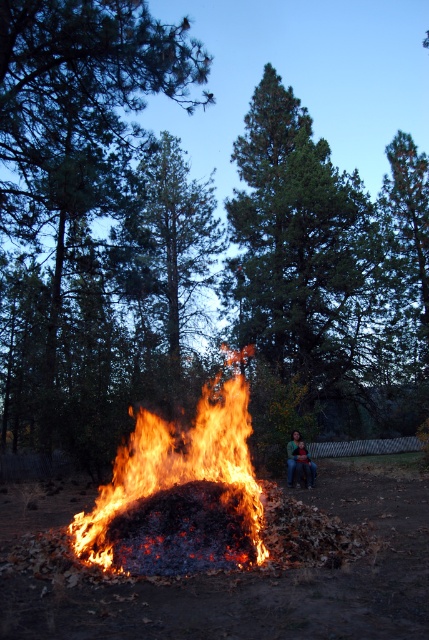
You are standing in front of the bonfire and want to place an object at point (268, 557) and another object at point (290, 436). Which point is closer to you?

Point (268, 557) is closer to the camera than point (290, 436), so the object placed at point (268, 557) will be closer to you.

You are standing in the dusk scene with a bonfire. You see the flaming wood at center and the green knitted sweater at center. Which object is positioned higher from the ground?

The flaming wood at center is located above the green knitted sweater at center, so the flaming wood at center is higher.